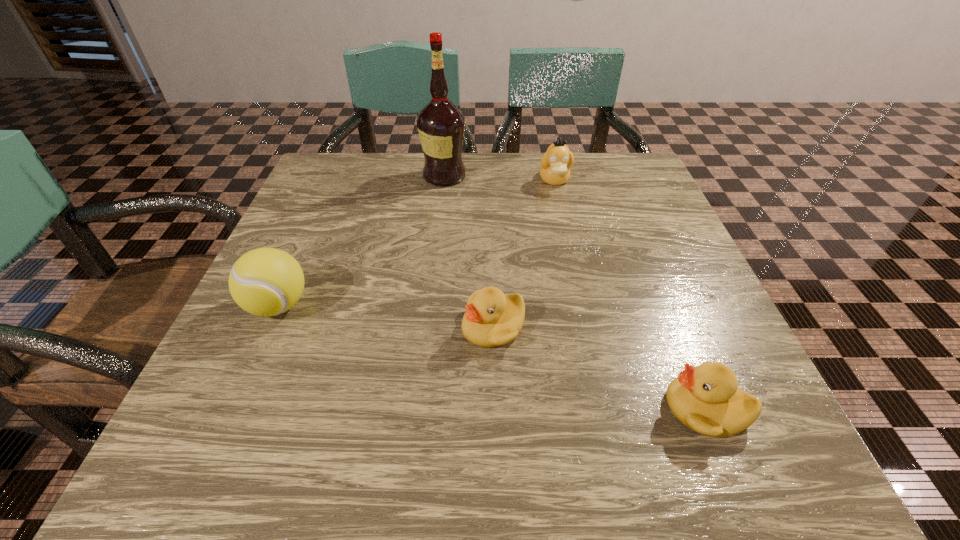
Locate an element on the screen. This screenshot has height=540, width=960. free spot located 0.100m on the front of the leftmost object is located at coordinates (244, 383).

Locate an element on the screen. vacant space located 0.050m on the face of the fourth object from left to right is located at coordinates click(560, 205).

Find the location of a particular element. This screenshot has height=540, width=960. free region located on the beak of the second nearest duckling is located at coordinates (307, 327).

Find the location of `free space located on the beak of the second nearest duckling`. free space located on the beak of the second nearest duckling is located at coordinates (324, 327).

This screenshot has height=540, width=960. I want to click on vacant region located 0.320m on the beak of the second nearest duckling, so click(x=271, y=327).

Where is `free spot located 0.230m on the front-facing side of the rightmost duckling`? This screenshot has width=960, height=540. free spot located 0.230m on the front-facing side of the rightmost duckling is located at coordinates (506, 408).

You are a GUI agent. You are given a task and a screenshot of the screen. Output one action in this format:
    pyautogui.click(x=<x>, y=<y>)
    Task: Click on the free spot located 0.070m on the front-facing side of the rightmost duckling
    The width and height of the screenshot is (960, 540).
    Given the screenshot: What is the action you would take?
    pyautogui.click(x=617, y=408)

In order to click on free location located 0.350m on the front-facing side of the rightmost duckling in this screenshot , I will do `click(422, 408)`.

The width and height of the screenshot is (960, 540). In order to click on alcohol situated at the far edge in this screenshot , I will do `click(440, 124)`.

You are a GUI agent. You are given a task and a screenshot of the screen. Output one action in this format:
    pyautogui.click(x=<x>, y=<y>)
    Task: Click on the duckling at the far edge
    
    Given the screenshot: What is the action you would take?
    pyautogui.click(x=556, y=162)